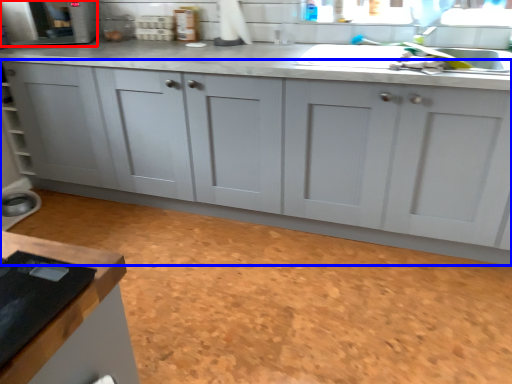
Question: Which point is further to the camera, appliance (highlighted by a red box) or cabinetry (highlighted by a blue box)?

Choices:
 (A) appliance
 (B) cabinetry

Answer: (A)